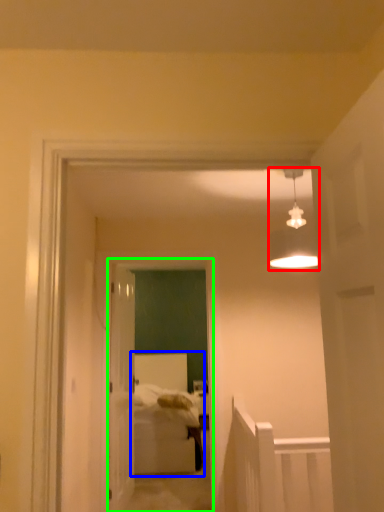
Question: Which object is positioned farthest from light fixture (highlighted by a red box)? Select from bed (highlighted by a blue box) and glass door (highlighted by a green box).

Choices:
 (A) bed
 (B) glass door

Answer: (A)